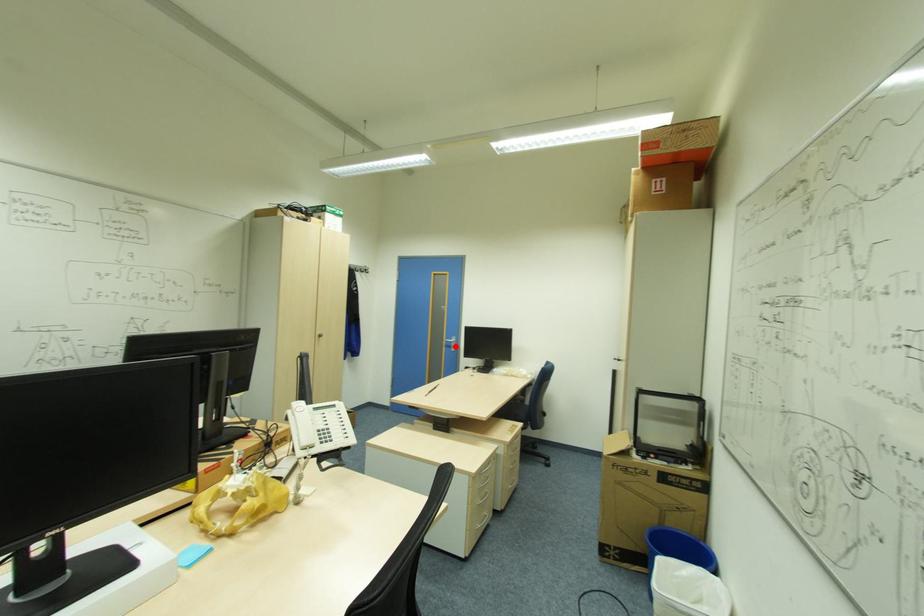
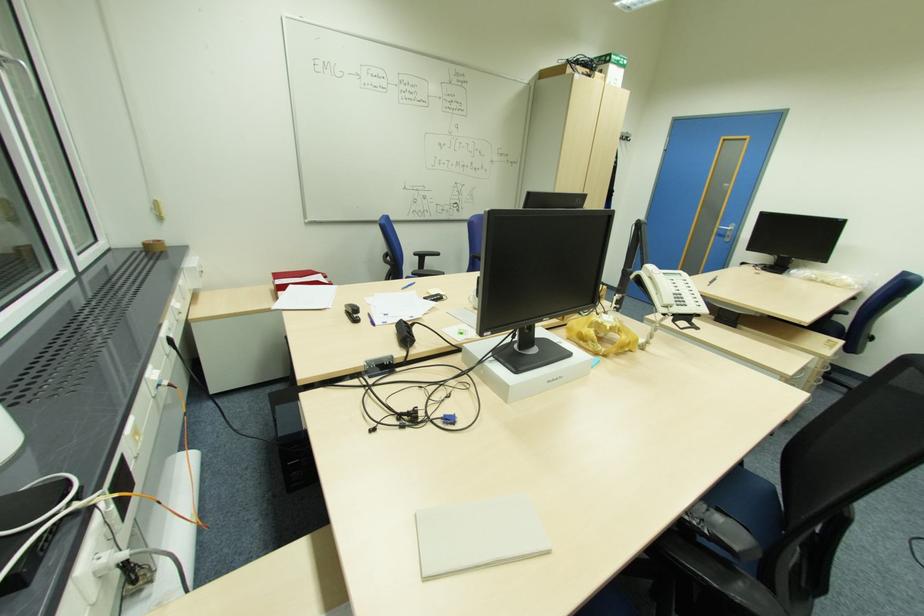
Question: I am providing you with two images of the same scene from different viewpoints. A red point is shown in image1. For the corresponding object point in image2, is it positioned nearer or farther from the camera?

Choices:
 (A) Nearer
 (B) Farther

Answer: (A)